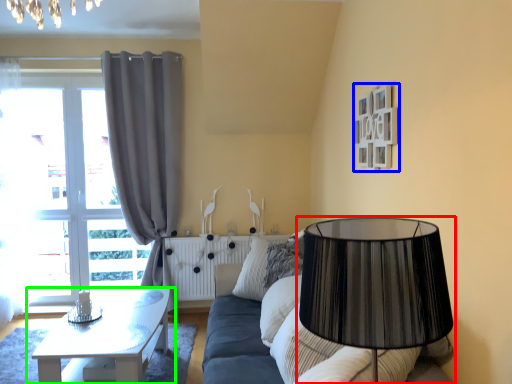
Question: Which object is positioned farthest from lamp (highlighted by a red box)? Select from picture frame (highlighted by a blue box) and table (highlighted by a green box).

Choices:
 (A) picture frame
 (B) table

Answer: (B)